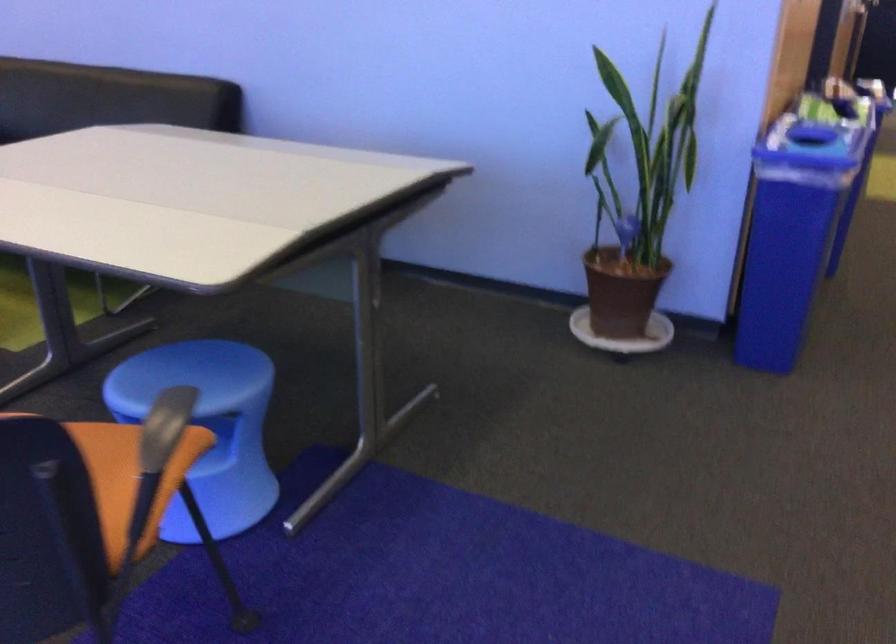
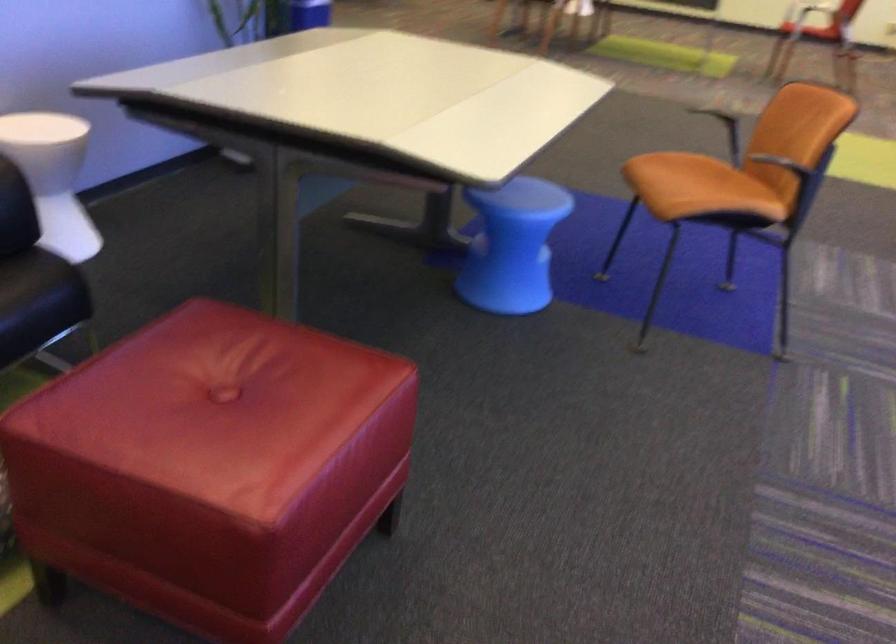
Where in the second image is the point corresponding to (x=117, y=514) from the first image?

(711, 173)